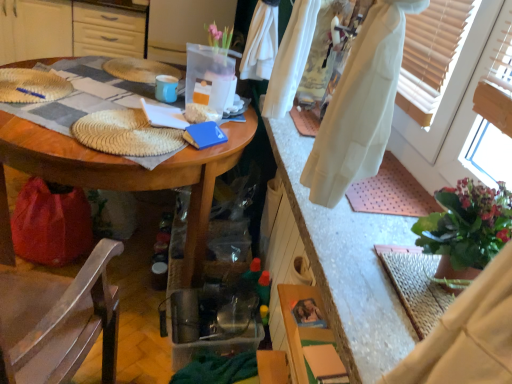
Question: In terms of height, does wooden table at upper left look taller or shorter compared to wooden chair at lower left?

Choices:
 (A) short
 (B) tall

Answer: (A)

Question: Does point (26, 14) appear closer or farther from the camera than point (114, 314)?

Choices:
 (A) closer
 (B) farther

Answer: (B)

Question: Which object is positioned farthest from the wooden table at center?

Choices:
 (A) white cotton robe at lower right
 (B) wooden chair at lower left
 (C) green leafy plant at right
 (D) wooden table at upper left

Answer: (D)

Question: Which object is the farthest from the wooden table at center?

Choices:
 (A) green leafy plant at right
 (B) wooden table at upper left
 (C) wooden chair at lower left
 (D) white cotton robe at lower right

Answer: (B)